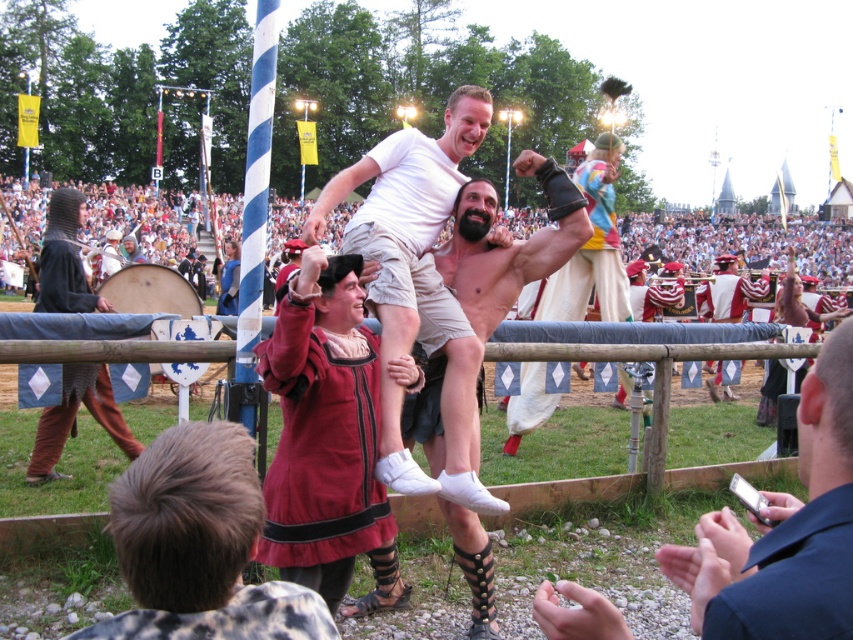
Is the position of dark brown leather boots at lower center more distant than that of dark red velvet robe at lower right?

Yes.

Does point (320, 628) lie in front of point (824, 612)?

That is False.

Which is in front, point (230, 568) or point (792, 570)?

Positioned in front is point (792, 570).

Identify the location of dark brown leather boots at lower center. This screenshot has width=853, height=640. (199, 545).

Who is shorter, shiny metallic helmet at center or white cotton t-shirt at center?

shiny metallic helmet at center is shorter.

Is point (817, 385) positioned before point (386, 337)?

Yes, point (817, 385) is in front of point (386, 337).

Where is `shiny metallic helmet at center`? The height and width of the screenshot is (640, 853). shiny metallic helmet at center is located at coordinates [x=784, y=531].

Who is positioned more to the right, shiny metallic helmet at center or shiny silver armor at center?

shiny silver armor at center is more to the right.

Is point (834, 426) behind point (704, 284)?

No, (834, 426) is closer to viewer.

Is point (839, 433) closer to viewer compared to point (715, 262)?

That is True.

Find the location of a particular element. The height and width of the screenshot is (640, 853). shiny metallic helmet at center is located at coordinates (784, 531).